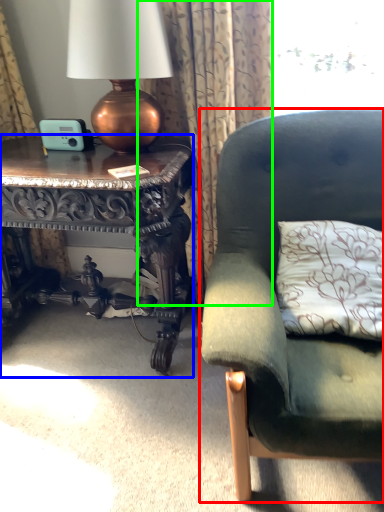
Question: Which object is positioned farthest from studio couch (highlighted by a red box)? Select from table (highlighted by a blue box) and curtain (highlighted by a green box).

Choices:
 (A) table
 (B) curtain

Answer: (A)